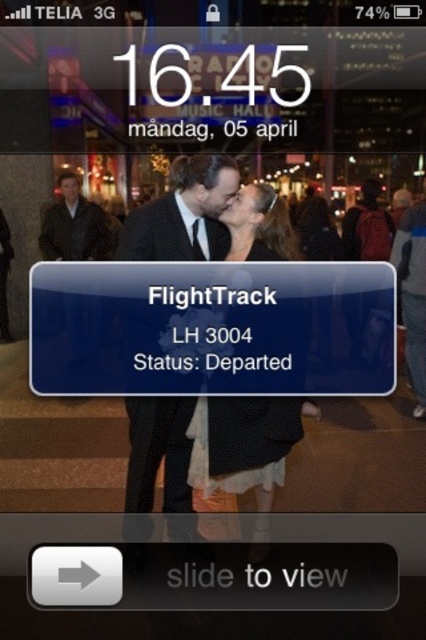
Question: Does matte black dress at center appear on the right side of blue fabric jacket at right?

Choices:
 (A) no
 (B) yes

Answer: (A)

Question: Estimate the real-world distances between objects in this image. Which object is closer to the black suit at center?

Choices:
 (A) blue fabric jacket at right
 (B) leather jacket at left
 (C) matte black dress at center
 (D) black silk suit at center

Answer: (C)

Question: Does blue fabric jacket at right have a lesser width compared to leather jacket at left?

Choices:
 (A) no
 (B) yes

Answer: (B)

Question: Is black suit at center wider than matte black dress at center?

Choices:
 (A) no
 (B) yes

Answer: (A)

Question: Among these points, which one is farthest from the camera?

Choices:
 (A) (287, 452)
 (B) (164, 412)
 (C) (94, 221)

Answer: (A)

Question: Based on their relative distances, which object is farther from the leather jacket at left?

Choices:
 (A) matte black dress at center
 (B) black suit at center

Answer: (A)